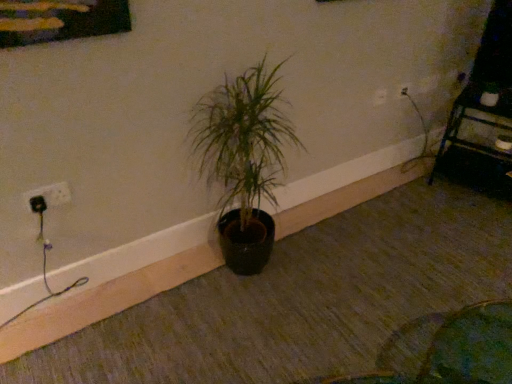
Question: Is white plastic electric outlet at upper right, which is the second electric outlet in bottom-to-top order, taller than white plastic socket at left, placed as the 2th electric outlet when sorted from right to left?

Choices:
 (A) yes
 (B) no

Answer: (A)

Question: From a real-world perspective, is white plastic electric outlet at upper right, which is the second electric outlet in bottom-to-top order, below white plastic socket at left, placed as the 2th electric outlet when sorted from right to left?

Choices:
 (A) no
 (B) yes

Answer: (A)

Question: Are white plastic electric outlet at upper right, positioned as the 2th electric outlet in left-to-right order, and white plastic socket at left, placed as the 2th electric outlet when sorted from right to left, beside each other?

Choices:
 (A) no
 (B) yes

Answer: (A)

Question: Is white plastic electric outlet at upper right, the first electric outlet positioned from the right, surrounding white plastic socket at left, acting as the 2th electric outlet starting from the top?

Choices:
 (A) yes
 (B) no

Answer: (B)

Question: Is there a large distance between white plastic electric outlet at upper right, placed as the 1th electric outlet when sorted from back to front, and white plastic socket at left, which is counted as the 1th electric outlet, starting from the left?

Choices:
 (A) no
 (B) yes

Answer: (B)

Question: Considering the relative sizes of white plastic electric outlet at upper right, which is the 1th electric outlet in top-to-bottom order, and white plastic socket at left, acting as the 2th electric outlet starting from the top, in the image provided, is white plastic electric outlet at upper right, which is the 1th electric outlet in top-to-bottom order, shorter than white plastic socket at left, acting as the 2th electric outlet starting from the top,?

Choices:
 (A) no
 (B) yes

Answer: (A)

Question: Can you confirm if white plastic socket at left, acting as the 2th electric outlet starting from the top, is positioned to the right of green matte plant at center?

Choices:
 (A) no
 (B) yes

Answer: (A)

Question: Is white plastic socket at left, placed as the second electric outlet when sorted from back to front, taller than green matte plant at center?

Choices:
 (A) yes
 (B) no

Answer: (B)

Question: Is white plastic socket at left, acting as the 2th electric outlet starting from the top, positioned beyond the bounds of green matte plant at center?

Choices:
 (A) no
 (B) yes

Answer: (B)

Question: Is white plastic socket at left, placed as the second electric outlet when sorted from back to front, facing away from green matte plant at center?

Choices:
 (A) no
 (B) yes

Answer: (A)

Question: Is green matte plant at center completely or partially inside white plastic socket at left, which is counted as the 1th electric outlet, starting from the left?

Choices:
 (A) yes
 (B) no

Answer: (B)

Question: Does white plastic socket at left, placed as the second electric outlet when sorted from back to front, have a smaller size compared to green matte plant at center?

Choices:
 (A) no
 (B) yes

Answer: (B)

Question: Is the depth of metallic black shelf at upper right less than that of green matte plant at center?

Choices:
 (A) no
 (B) yes

Answer: (A)